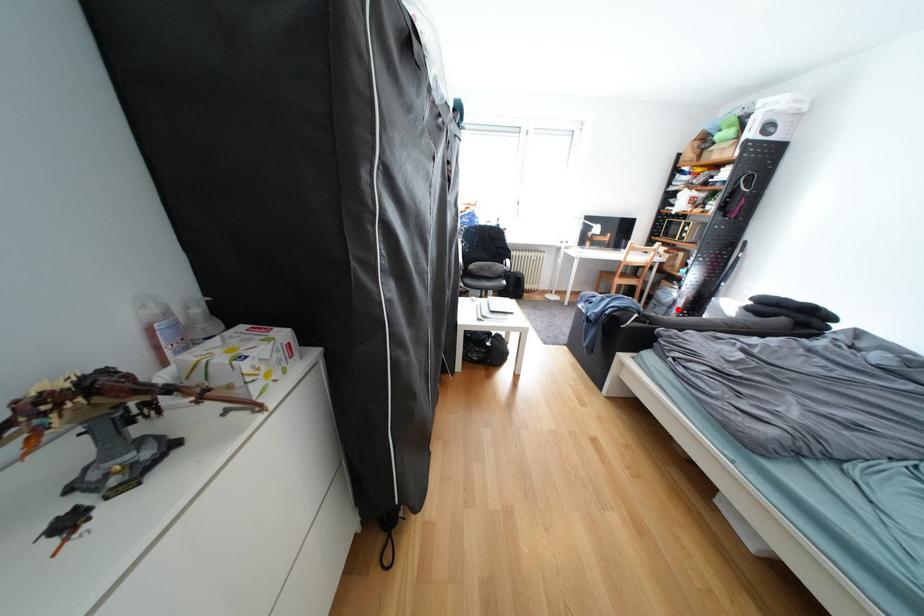
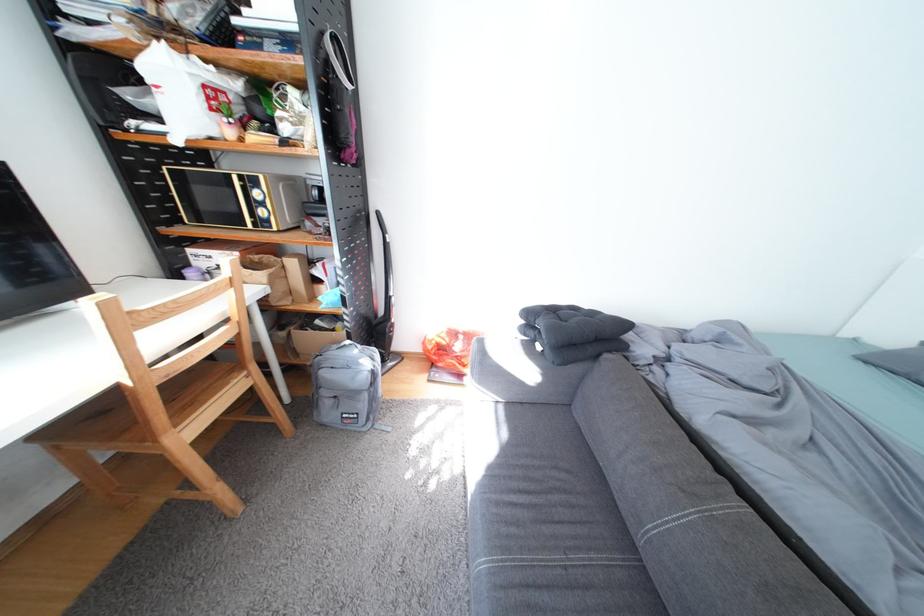
Find the pixel in the second image that matches the highlighted location in the first image.

(378, 397)